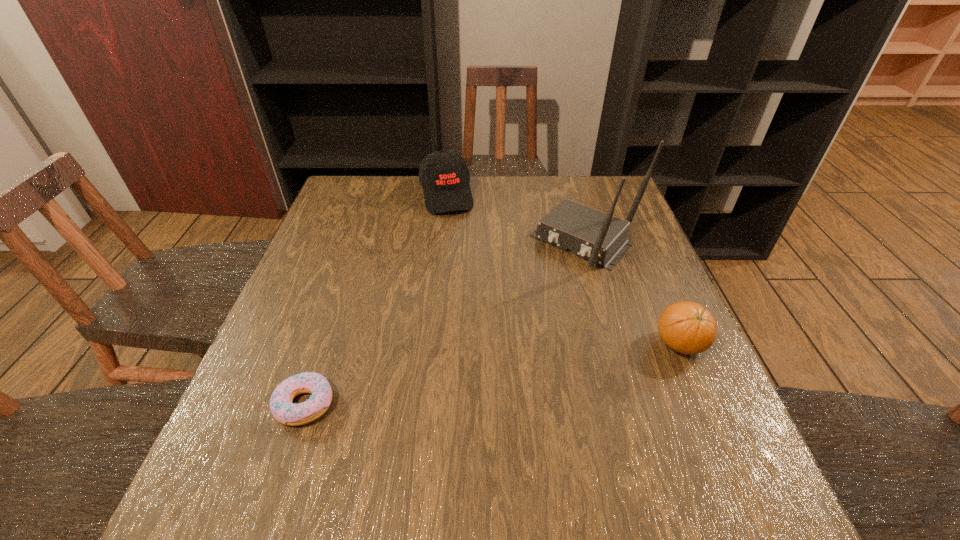
The image size is (960, 540). I want to click on free space between the doughnut and the orange, so click(492, 374).

Locate an element on the screen. vacant area that lies between the third tallest object and the doughnut is located at coordinates pos(492,374).

The image size is (960, 540). In order to click on free space between the second shortest object and the baseball cap in this screenshot , I will do `click(563, 269)`.

You are a GUI agent. You are given a task and a screenshot of the screen. Output one action in this format:
    pyautogui.click(x=<x>, y=<y>)
    Task: Click on the free space between the orange and the doughnut
    Image resolution: width=960 pixels, height=540 pixels.
    Given the screenshot: What is the action you would take?
    pyautogui.click(x=492, y=374)

At what (x,y) coordinates should I click in order to perform the action: click on vacant area that lies between the third tallest object and the tallest object. Please return your answer as a coordinate pair (x, y). The image size is (960, 540). Looking at the image, I should click on (633, 293).

Where is `vacant area that lies between the router and the shortest object`? vacant area that lies between the router and the shortest object is located at coordinates (x=444, y=323).

Where is `blank region between the orange and the shortest object`? Image resolution: width=960 pixels, height=540 pixels. blank region between the orange and the shortest object is located at coordinates (492, 374).

The width and height of the screenshot is (960, 540). What are the coordinates of `vacant area that lies between the router and the baseball cap` in the screenshot? It's located at (516, 219).

Locate an element on the screen. The width and height of the screenshot is (960, 540). free point between the second nearest object and the shortest object is located at coordinates (492, 374).

This screenshot has height=540, width=960. I want to click on object that is the second closest to the tallest object, so click(444, 175).